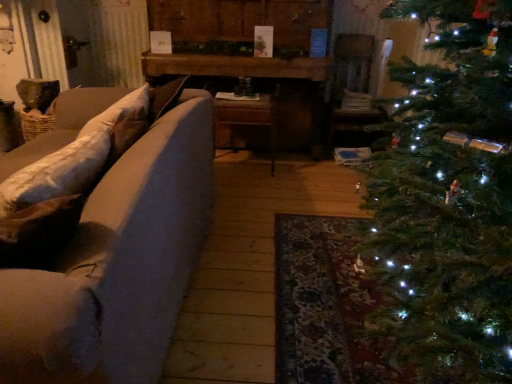
Question: From a real-world perspective, is matte gray couch at left over wooden table at center?

Choices:
 (A) yes
 (B) no

Answer: (B)

Question: From the image's perspective, would you say matte gray couch at left is shown under wooden table at center?

Choices:
 (A) yes
 (B) no

Answer: (A)

Question: Considering the relative positions of matte gray couch at left and wooden table at center in the image provided, is matte gray couch at left to the right of wooden table at center from the viewer's perspective?

Choices:
 (A) yes
 (B) no

Answer: (B)

Question: Is matte gray couch at left aimed at wooden table at center?

Choices:
 (A) yes
 (B) no

Answer: (B)

Question: From a real-world perspective, is matte gray couch at left positioned under wooden table at center based on gravity?

Choices:
 (A) yes
 (B) no

Answer: (A)

Question: Can you confirm if matte gray couch at left is wider than wooden table at center?

Choices:
 (A) no
 (B) yes

Answer: (B)

Question: Is wooden table at center next to matte gray couch at left?

Choices:
 (A) yes
 (B) no

Answer: (B)

Question: Is wooden table at center behind matte gray couch at left?

Choices:
 (A) yes
 (B) no

Answer: (A)

Question: Is wooden table at center taller than matte gray couch at left?

Choices:
 (A) yes
 (B) no

Answer: (A)

Question: Does wooden table at center have a greater width compared to matte gray couch at left?

Choices:
 (A) no
 (B) yes

Answer: (A)

Question: Can you confirm if wooden table at center is smaller than matte gray couch at left?

Choices:
 (A) no
 (B) yes

Answer: (B)

Question: From a real-world perspective, is wooden table at center located beneath matte gray couch at left?

Choices:
 (A) no
 (B) yes

Answer: (A)

Question: Does point (292, 137) appear closer or farther from the camera than point (129, 175)?

Choices:
 (A) closer
 (B) farther

Answer: (B)